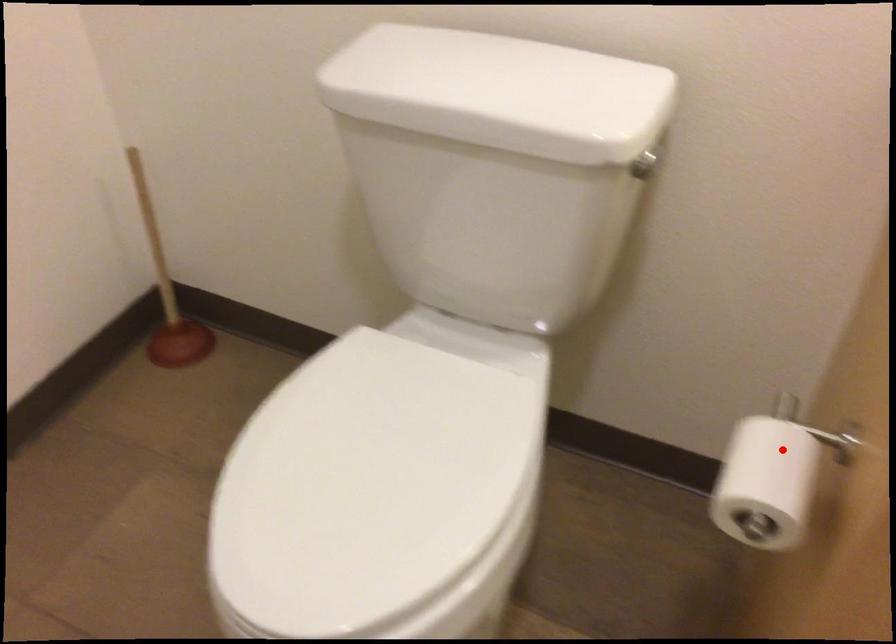
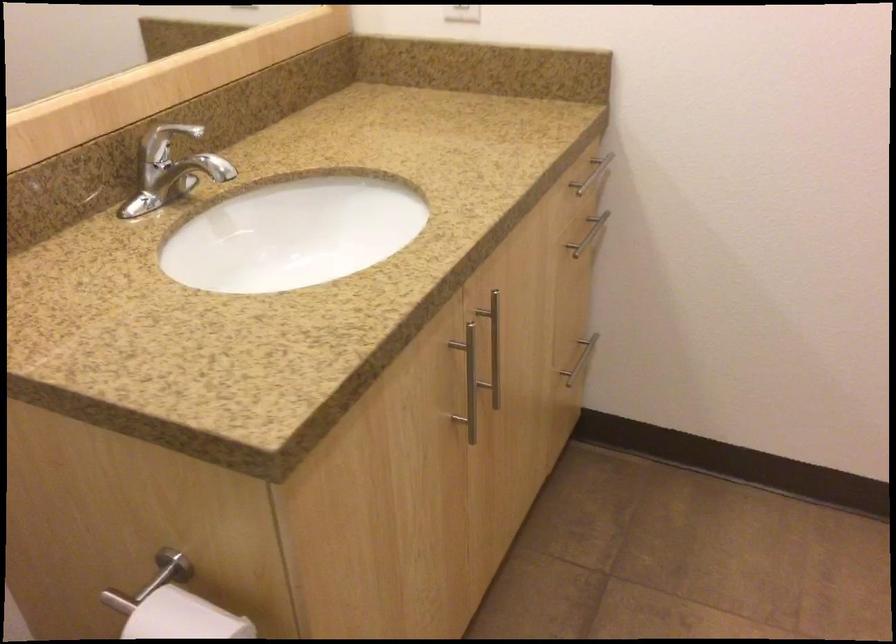
In the second image, find the point that corresponds to the highlighted location in the first image.

(183, 618)